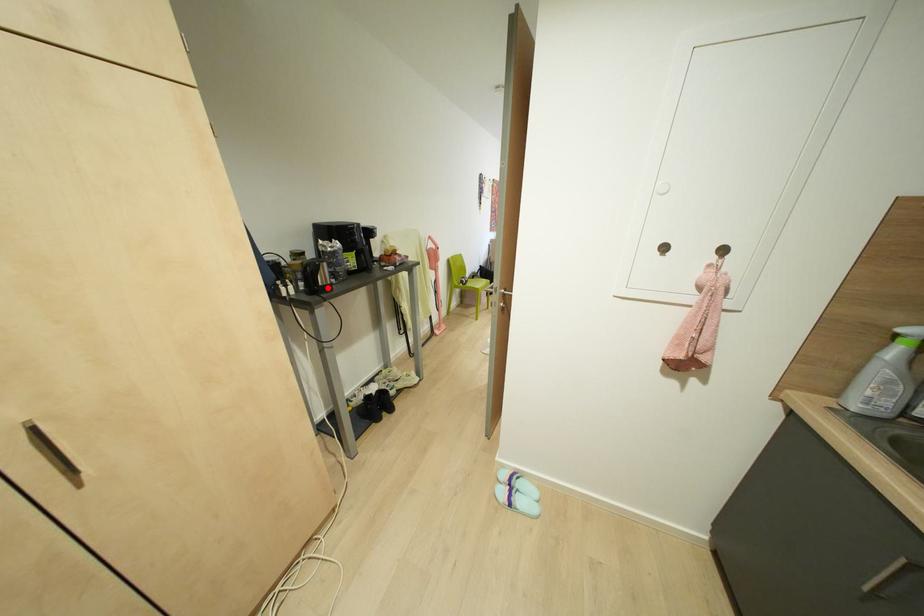
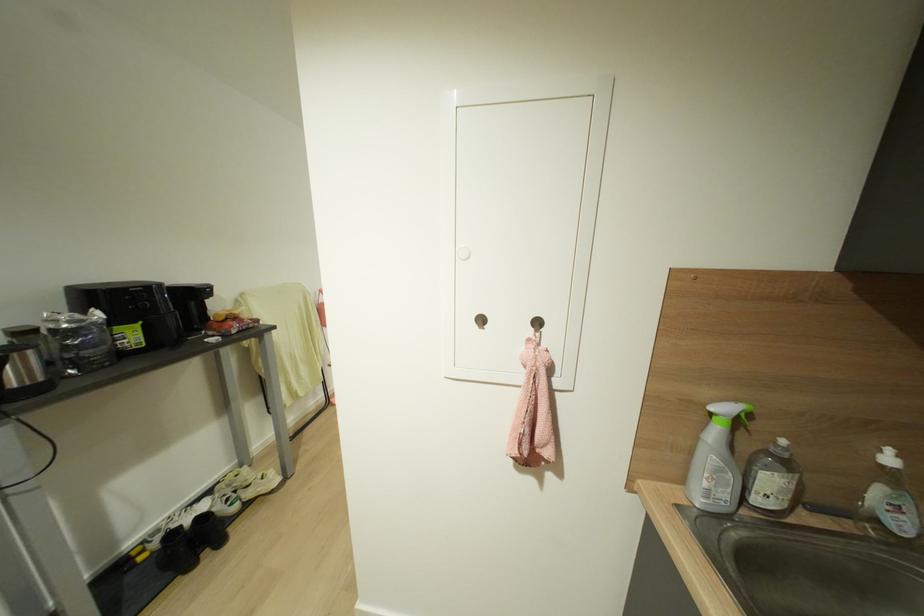
Question: I am providing you with two images of the same scene from different viewpoints. Image1 has a red point marked. In image2, the corresponding 3D location appears at what relative position? Reply with the corresponding letter.

Choices:
 (A) Closer
 (B) Farther

Answer: (B)